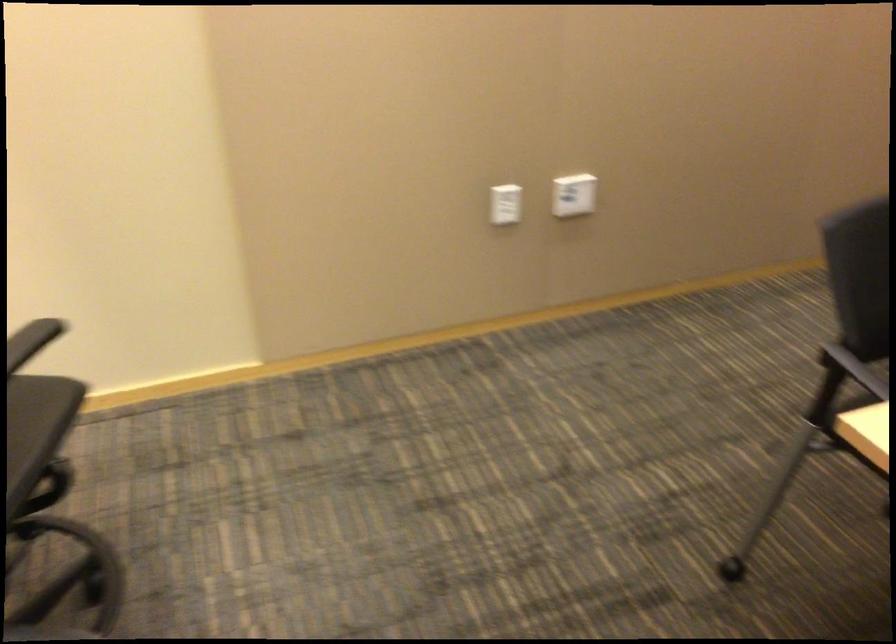
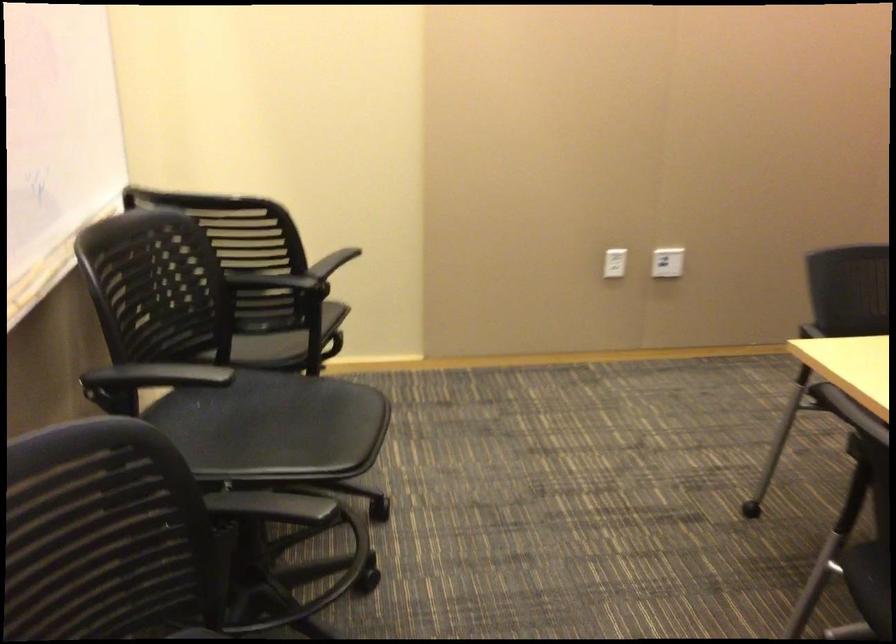
The point at (501, 210) is marked in the first image. Where is the corresponding point in the second image?

(615, 263)